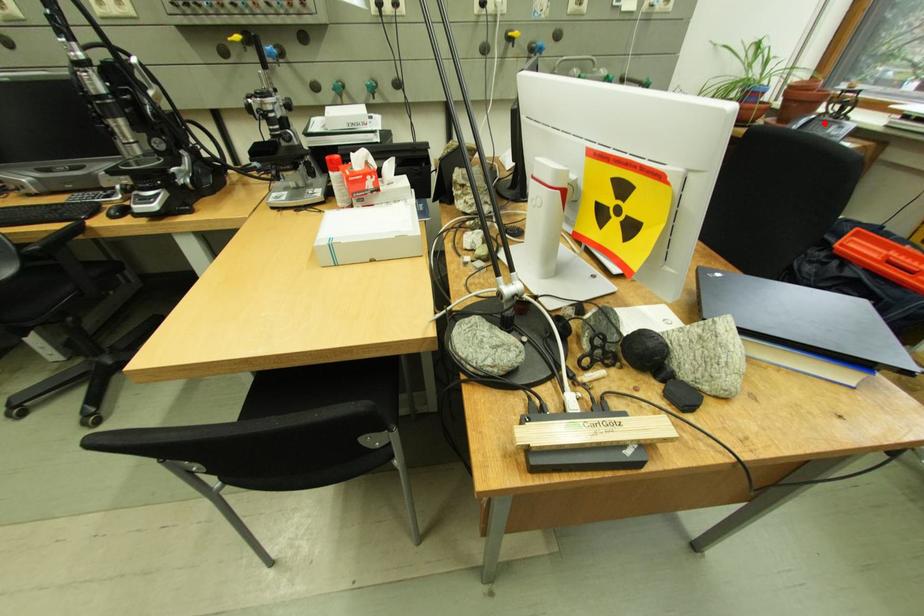
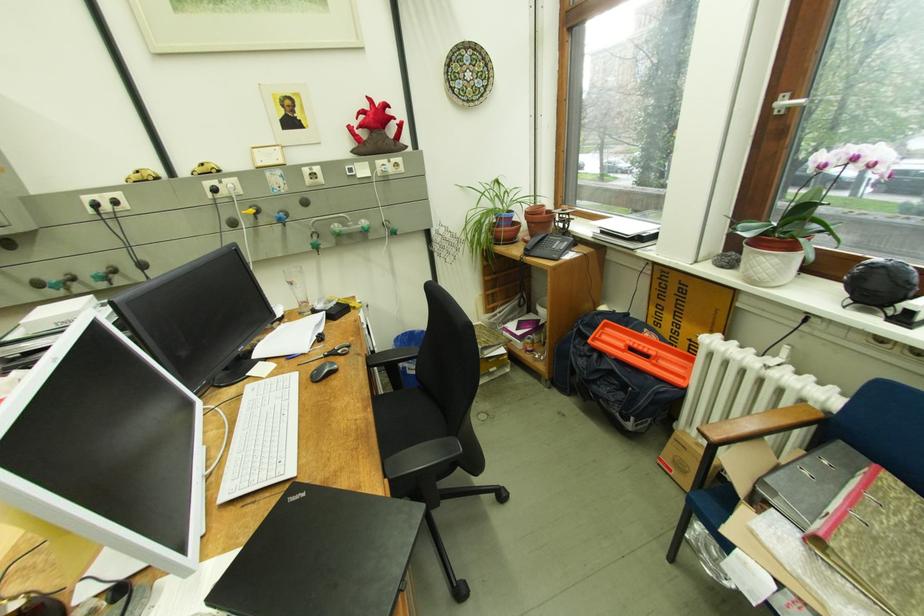
The point at the highlighted location is marked in the first image. Where is the corresponding point in the second image?

(555, 240)